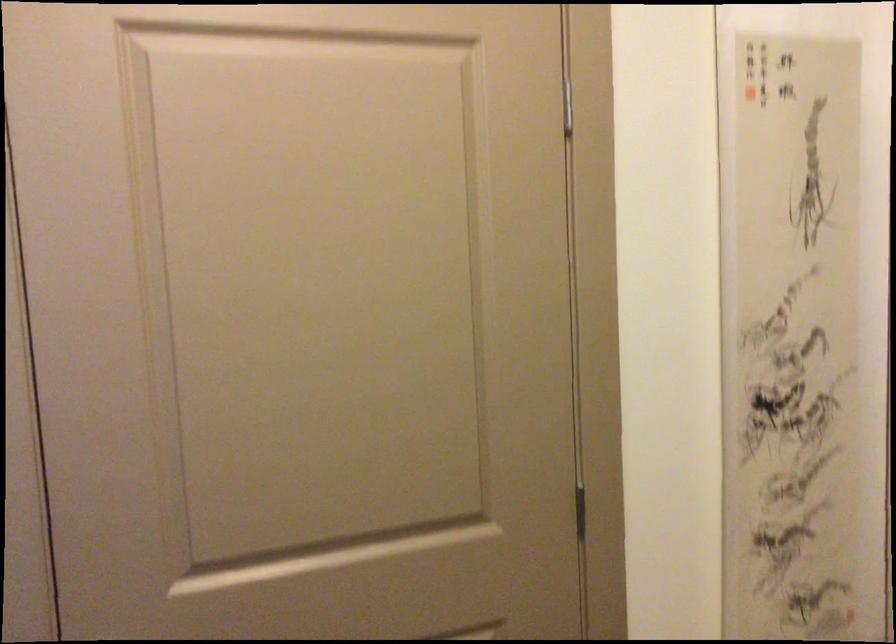
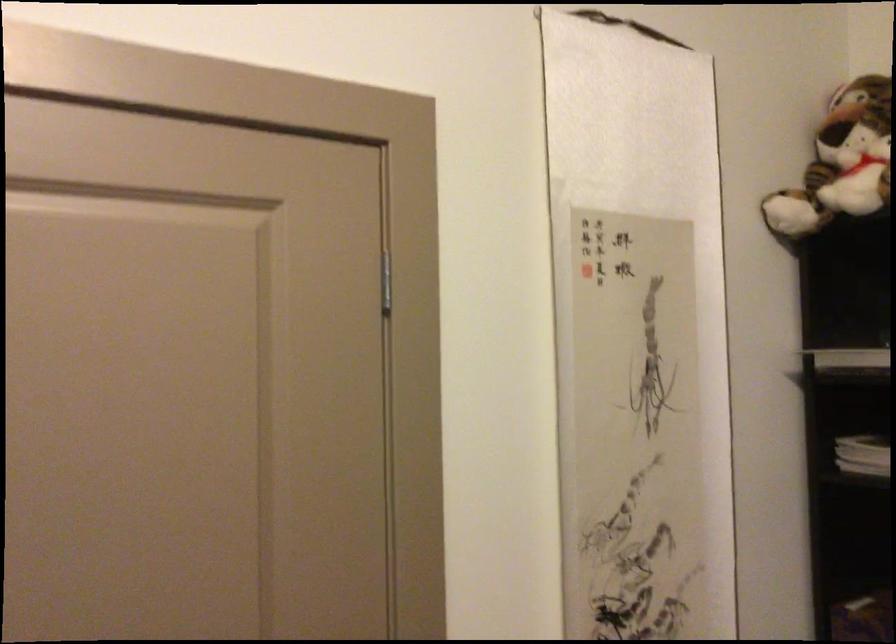
Question: What movement of the cameraman would produce the second image?

Choices:
 (A) Left
 (B) Right
 (C) Forward
 (D) Backward

Answer: (C)